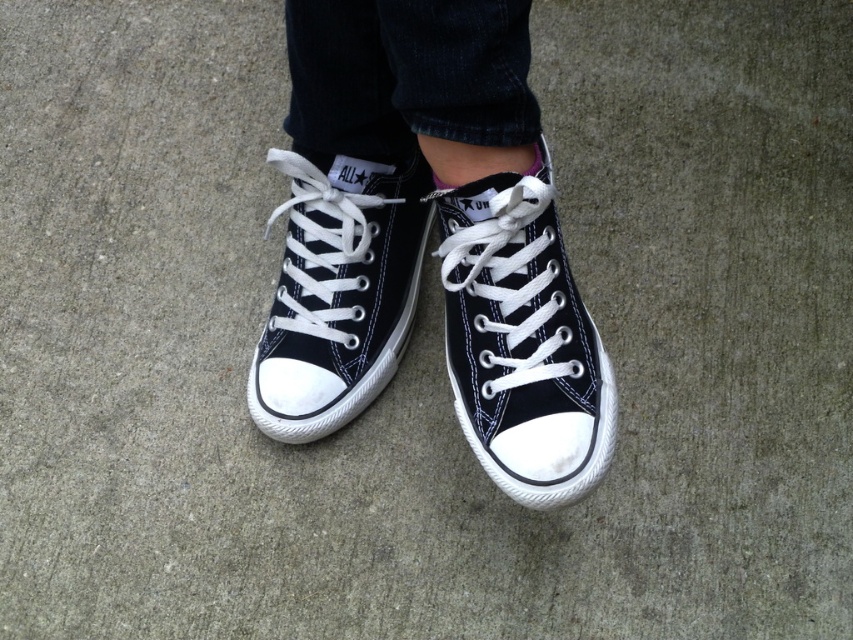
Question: Which point is farther to the camera?

Choices:
 (A) black canvas sneaker at center
 (B) black canvas shoe at center
 (C) black canvas sneakers at center

Answer: (A)

Question: Which of the following is the closest to the observer?

Choices:
 (A) (521, 384)
 (B) (352, 195)

Answer: (A)

Question: Is black canvas sneakers at center positioned at the back of black canvas shoe at center?

Choices:
 (A) no
 (B) yes

Answer: (A)

Question: Among these objects, which one is nearest to the camera?

Choices:
 (A) black canvas shoe at center
 (B) black canvas sneakers at center
 (C) black canvas sneaker at center

Answer: (B)

Question: Is black canvas sneakers at center further to the viewer compared to black canvas sneaker at center?

Choices:
 (A) yes
 (B) no

Answer: (B)

Question: Where is black canvas sneakers at center located in relation to black canvas sneaker at center in the image?

Choices:
 (A) right
 (B) left

Answer: (A)